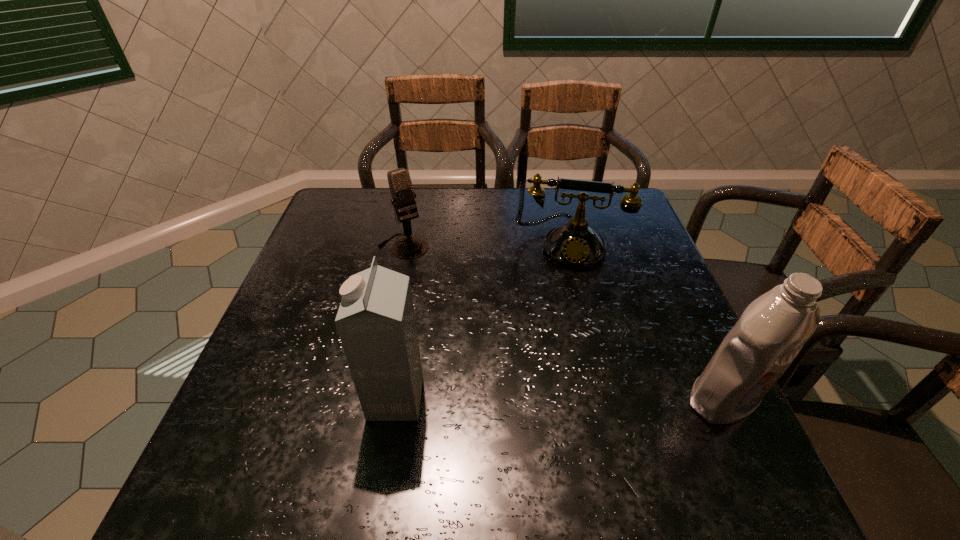
Find the location of a particular element. The height and width of the screenshot is (540, 960). free space that is in between the carton and the detergent is located at coordinates (560, 399).

Image resolution: width=960 pixels, height=540 pixels. I want to click on empty space between the telephone and the carton, so click(482, 321).

This screenshot has height=540, width=960. I want to click on vacant space that is in between the detergent and the telephone, so click(x=646, y=322).

The image size is (960, 540). In order to click on free point between the microphone and the detergent in this screenshot , I will do `click(564, 323)`.

Find the location of `empty space that is in between the telephone and the carton`. empty space that is in between the telephone and the carton is located at coordinates (482, 321).

The image size is (960, 540). I want to click on vacant space in between the microphone and the telephone, so click(486, 245).

Locate an element on the screen. free space between the carton and the telephone is located at coordinates (482, 321).

In order to click on vacant space that's between the telephone and the carton in this screenshot , I will do `click(482, 321)`.

You are a GUI agent. You are given a task and a screenshot of the screen. Output one action in this format:
    pyautogui.click(x=<x>, y=<y>)
    Task: Click on the third closest object to the microphone
    Image resolution: width=960 pixels, height=540 pixels.
    Given the screenshot: What is the action you would take?
    pyautogui.click(x=771, y=331)

Select which object appears as the closest to the telephone. Please provide its 2D coordinates. Your answer should be formatted as a tuple, i.e. [(x, y)], where the tuple contains the x and y coordinates of a point satisfying the conditions above.

[(410, 247)]